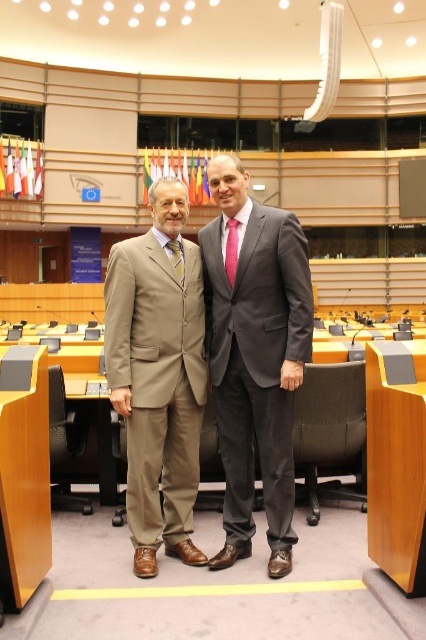
You are a photographer positioned at the point with coordinates (158, 378) in the image. What object is directly in front of you?

The point at coordinates (158, 378) corresponds to the tan fabric suit at center, so the tan fabric suit at center is directly in front of you.

You are a photographer standing in front of the two men. You need to take a photo that clearly shows both the matte beige suit at center and the dark gray suit at center. Which suit will appear larger in the photo?

The matte beige suit at center will appear larger in the photo because it is closer to the viewer than the dark gray suit at center.

Consider the image. You are a photographer setting up for an international event. You need to position a backdrop that must be placed behind both the tan fabric suit at center and the dark gray suit at center. Given their sizes, which suit requires the backdrop to be larger to fully cover it?

The tan fabric suit at center is bigger than the dark gray suit at center, so the backdrop needs to be larger to fully cover the tan fabric suit at center.